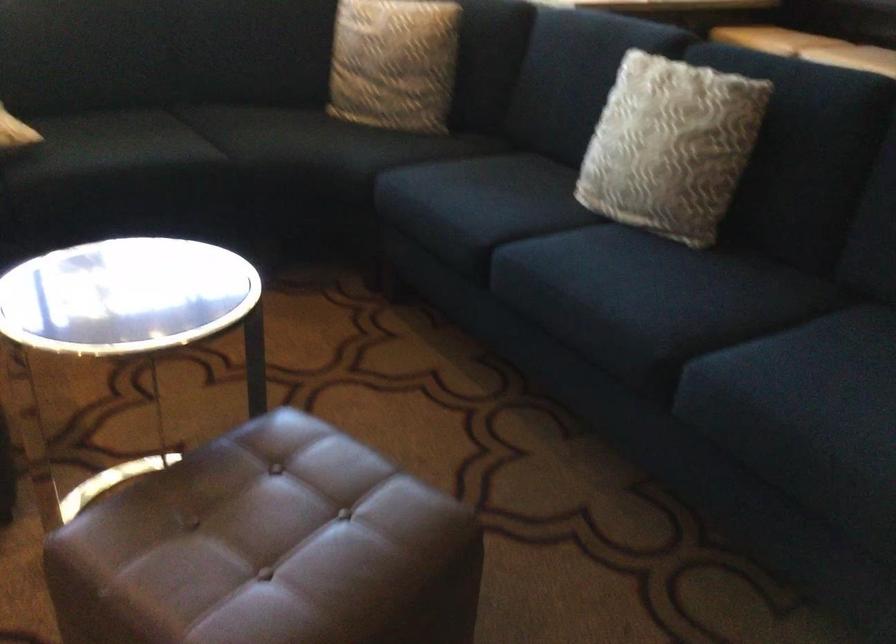
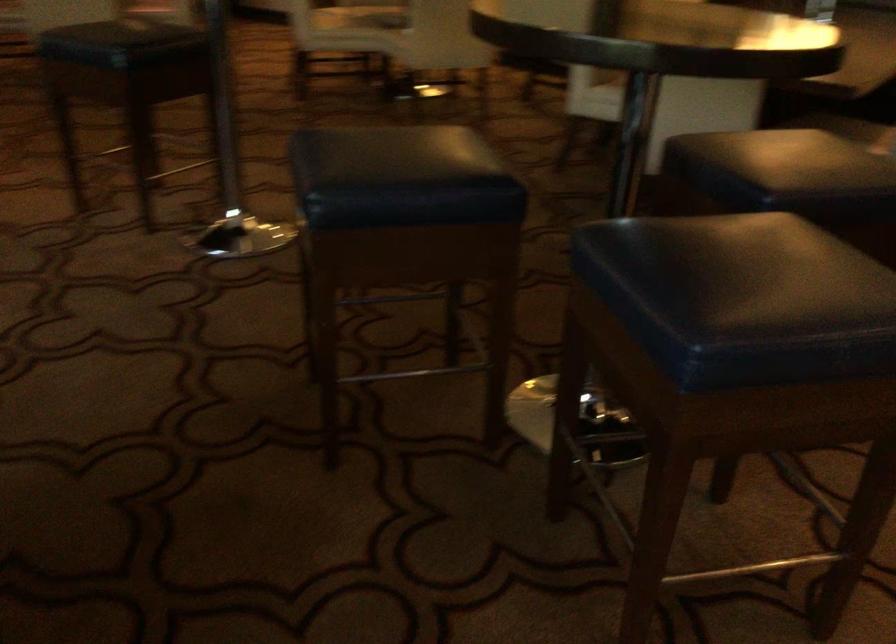
The first image is from the beginning of the video and the second image is from the end. How did the camera likely rotate when shooting the video?

The camera's rotation is toward right-down.